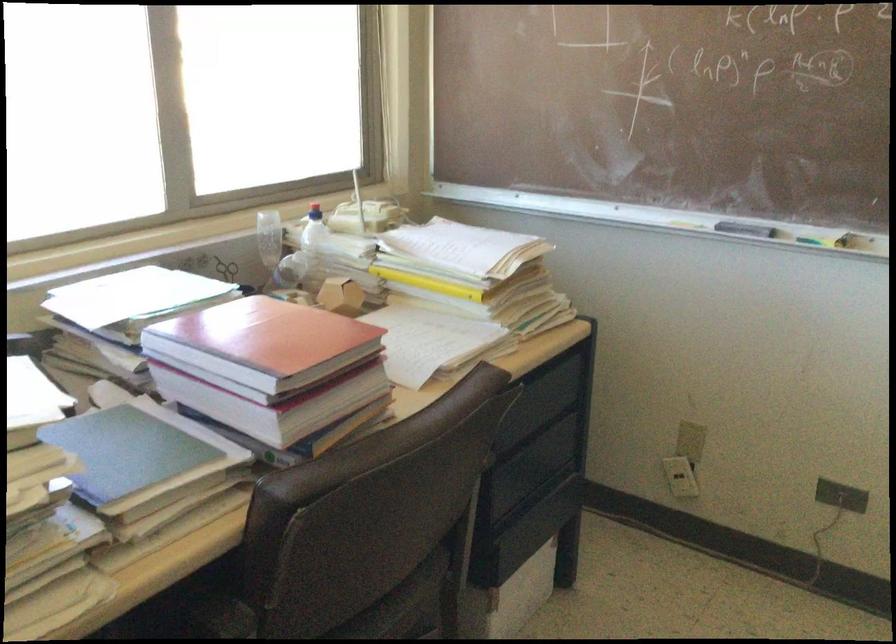
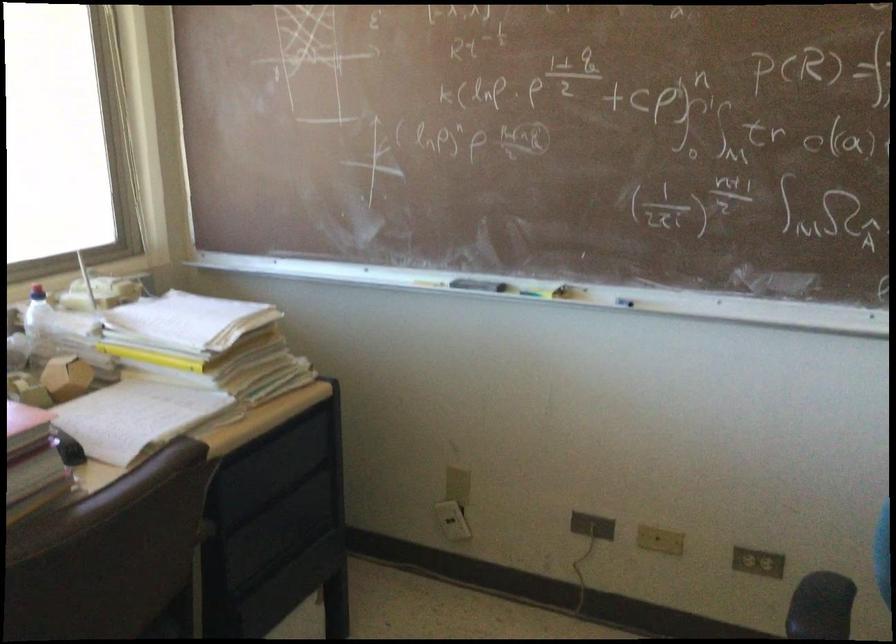
Where in the second image is the point corresponding to (x=555, y=436) from the first image?

(298, 506)